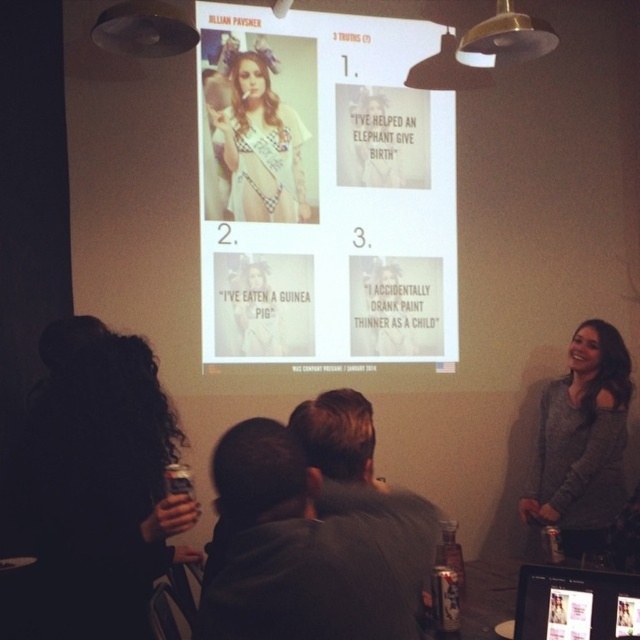
You are standing in the room and looking at the projection screen. There are two points marked on the screen at coordinates point (x=58, y=636) and point (x=216, y=115). Which point is closer to you?

Point (x=58, y=636) is closer to the camera than point (x=216, y=115), so the point closer to you is point (x=58, y=636).

You are an attendee at the presentation and notice two objects in the image. One is dark curly hair at lower left and the other is matte plastic screen at lower right. Which object appears bigger in the image?

The dark curly hair at lower left has a larger size compared to the matte plastic screen at lower right, so the dark curly hair at lower left appears bigger.

You are organizing a trivia night and need to place a white paper at center and a checkered fabric bikini at center on a small table. The table has limited space. Based on the scene description, which item should you place first to ensure both fit?

The white paper at center is bigger than the checkered fabric bikini at center, so you should place the checkered fabric bikini at center first to accommodate the larger white paper at center afterward.